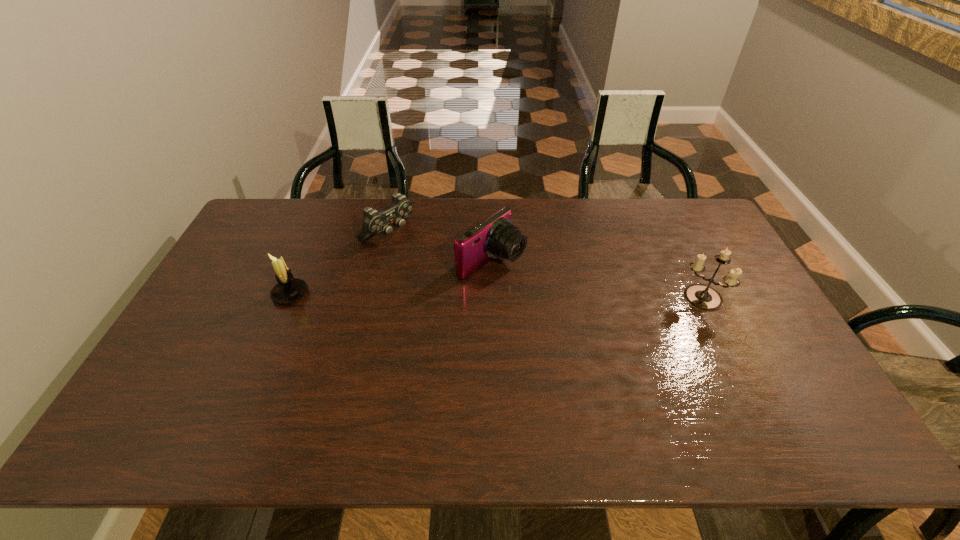
Identify the location of the leftmost object. (288, 290).

At what (x,y) coordinates should I click in order to perform the action: click on the right candle holder. Please return your answer as a coordinate pair (x, y). This screenshot has width=960, height=540. Looking at the image, I should click on (702, 297).

At what (x,y) coordinates should I click in order to perform the action: click on the third object from right to left. Please return your answer as a coordinate pair (x, y). This screenshot has height=540, width=960. Looking at the image, I should click on (374, 222).

You are a GUI agent. You are given a task and a screenshot of the screen. Output one action in this format:
    pyautogui.click(x=<x>, y=<y>)
    Task: Click on the second object from right to left
    This screenshot has width=960, height=540.
    Given the screenshot: What is the action you would take?
    pyautogui.click(x=496, y=237)

In order to click on free space located 0.170m on the front of the leftmost object in this screenshot , I will do click(x=264, y=355).

Identify the location of vacant position located on the right of the rightmost object. Image resolution: width=960 pixels, height=540 pixels. (754, 298).

In order to click on vacant region located on the surface of the second object from left to right with buttons in this screenshot , I will do `click(415, 251)`.

Find the location of a particular element. The image size is (960, 540). free point located 0.270m on the surface of the second object from left to right with buttons is located at coordinates (461, 283).

This screenshot has width=960, height=540. What are the coordinates of `vacant area situated 0.180m on the surface of the second object from left to right with buttons` in the screenshot? It's located at (441, 269).

At what (x,y) coordinates should I click in order to perform the action: click on blank area located 0.130m on the front-facing side of the third object from left to right. Please return your answer as a coordinate pair (x, y). Looking at the image, I should click on [x=552, y=296].